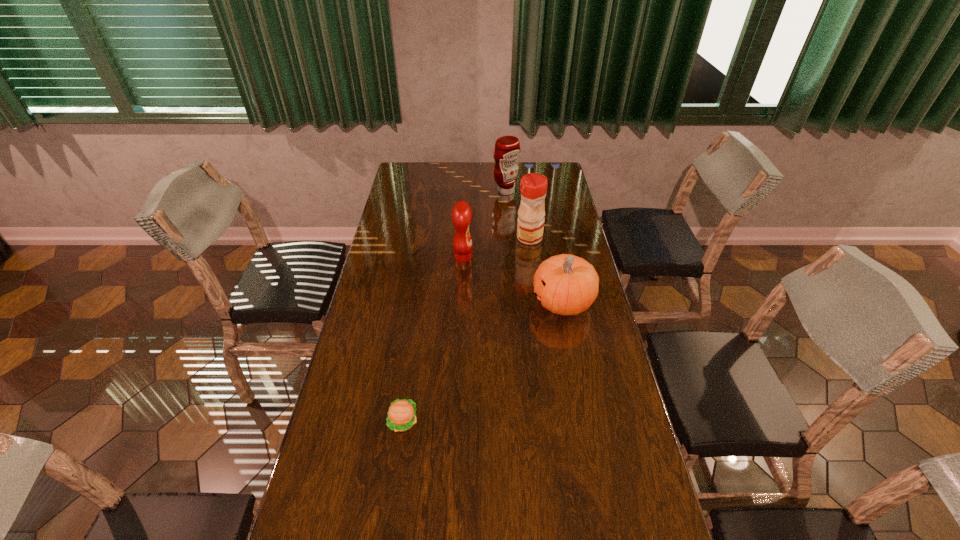
You are a GUI agent. You are given a task and a screenshot of the screen. Output one action in this format:
    pyautogui.click(x=<x>, y=<y>)
    Task: Click on the vacant area situated 0.060m on the front-facing side of the pumpkin
    
    Given the screenshot: What is the action you would take?
    coord(515,302)

Where is `vacant space located on the front-facing side of the pumpkin`? vacant space located on the front-facing side of the pumpkin is located at coordinates (509, 302).

What are the coordinates of `vacant space located 0.120m on the front-facing side of the pumpkin` in the screenshot? It's located at (497, 302).

Identify the location of vacant area situated on the back of the shortest object. (420, 307).

Where is `object at the far edge`? This screenshot has height=540, width=960. object at the far edge is located at coordinates (507, 148).

Locate an element on the screen. This screenshot has width=960, height=540. object present at the left edge is located at coordinates (401, 416).

Where is `condiment at the right edge`? This screenshot has width=960, height=540. condiment at the right edge is located at coordinates (533, 187).

Where is `pumpkin that is at the right edge`? pumpkin that is at the right edge is located at coordinates (565, 284).

In the image, there is a desktop. Identify the location of vacant space at the far edge. [x=453, y=182].

Where is `vacant region at the left edge`? The image size is (960, 540). vacant region at the left edge is located at coordinates (339, 388).